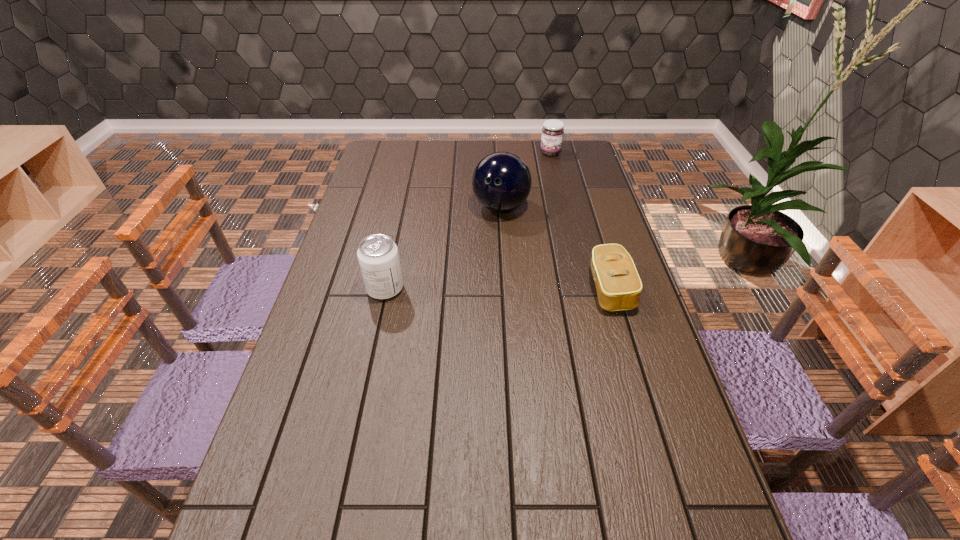
Locate an element on the screen. This screenshot has height=540, width=960. the second tallest object is located at coordinates (378, 257).

I want to click on soda can, so click(378, 257).

At what (x,y) coordinates should I click in order to perform the action: click on clutch bag. Please return your answer as a coordinate pair (x, y). Looking at the image, I should click on (618, 285).

Locate an element on the screen. The width and height of the screenshot is (960, 540). jam is located at coordinates (553, 130).

Where is `the third tallest object`? The height and width of the screenshot is (540, 960). the third tallest object is located at coordinates (553, 130).

This screenshot has height=540, width=960. I want to click on the third nearest object, so click(x=501, y=182).

Find the location of a particular element. This screenshot has height=540, width=960. the tallest object is located at coordinates (501, 182).

Locate an element on the screen. vacant area situated on the front of the leftmost object is located at coordinates (372, 352).

The image size is (960, 540). Identify the location of vacant space positioned 0.230m on the front label of the farthest object. (540, 187).

This screenshot has height=540, width=960. Identify the location of free space located on the front label of the farthest object. (546, 169).